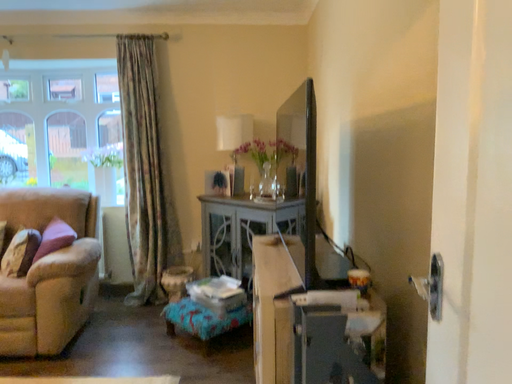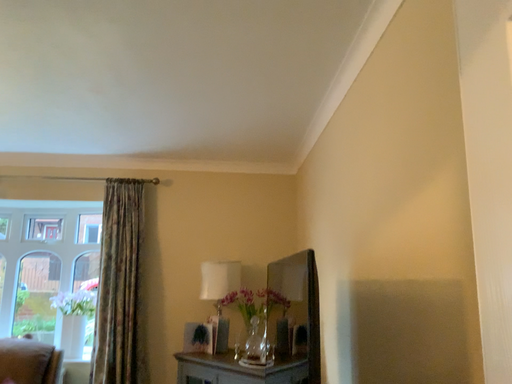
Question: Which way did the camera rotate in the video?

Choices:
 (A) rotated downward
 (B) rotated upward

Answer: (B)